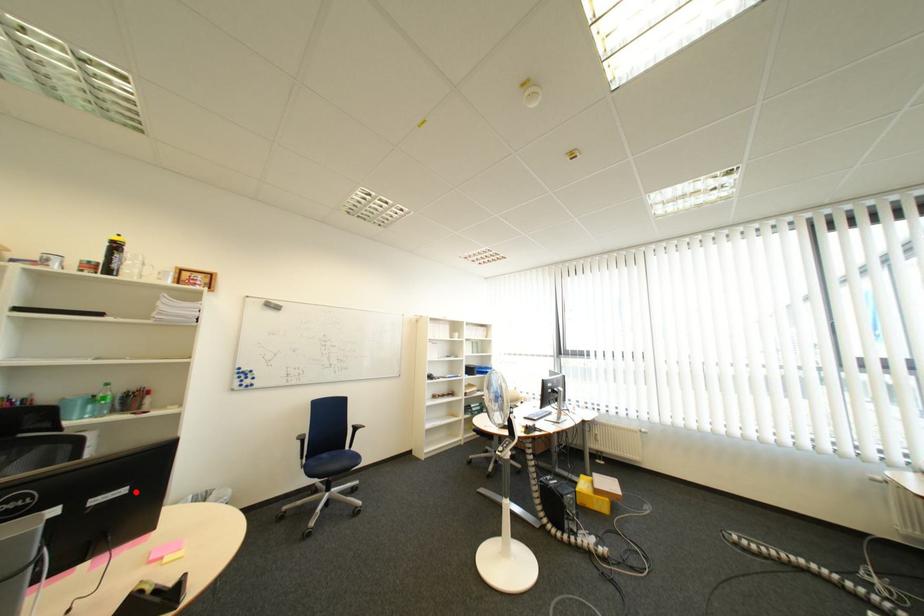
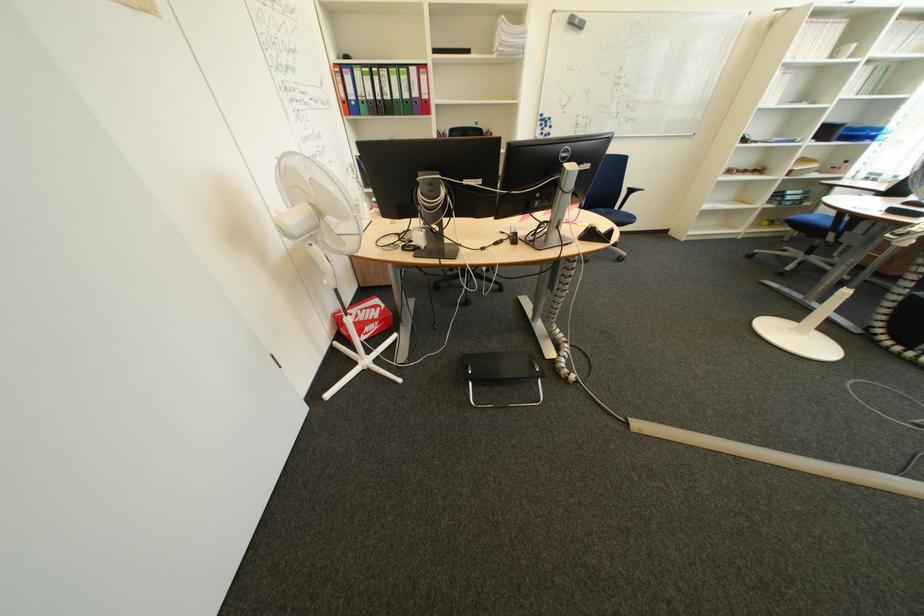
In the second image, find the point that corresponds to the highlighted location in the first image.

(601, 168)